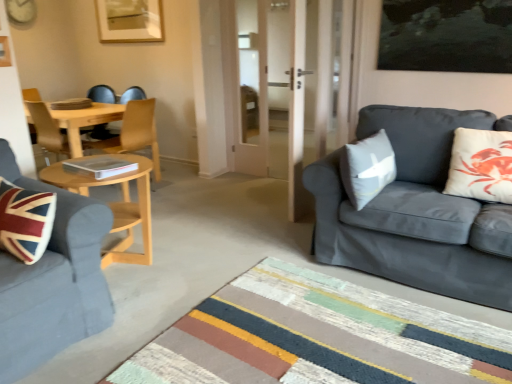
Question: Is velvet blue sofa at left, placed as the second studio couch when sorted from right to left, smaller than gray fabric pillow at right, which is counted as the first pillow, starting from the left?

Choices:
 (A) no
 (B) yes

Answer: (A)

Question: From a real-world perspective, is velvet blue sofa at left, the 1th studio couch from the left, physically above gray fabric pillow at right, the 2th pillow when ordered from right to left?

Choices:
 (A) yes
 (B) no

Answer: (B)

Question: From the image's perspective, is velvet blue sofa at left, the 1th studio couch from the left, over gray fabric pillow at right, which is counted as the first pillow, starting from the left?

Choices:
 (A) no
 (B) yes

Answer: (A)

Question: Does velvet blue sofa at left, the 1th studio couch from the left, have a greater width compared to gray fabric pillow at right, the 2th pillow when ordered from right to left?

Choices:
 (A) yes
 (B) no

Answer: (A)

Question: Considering the relative sizes of velvet blue sofa at left, placed as the second studio couch when sorted from right to left, and gray fabric pillow at right, which is counted as the first pillow, starting from the left, in the image provided, is velvet blue sofa at left, placed as the second studio couch when sorted from right to left, taller than gray fabric pillow at right, which is counted as the first pillow, starting from the left,?

Choices:
 (A) yes
 (B) no

Answer: (A)

Question: In the image, is velvet blue sofa at left, the 1th studio couch from the left, positioned in front of or behind light wood coffee table at center left?

Choices:
 (A) front
 (B) behind

Answer: (A)

Question: In terms of size, does velvet blue sofa at left, placed as the second studio couch when sorted from right to left, appear bigger or smaller than light wood coffee table at center left?

Choices:
 (A) big
 (B) small

Answer: (A)

Question: From a real-world perspective, relative to light wood coffee table at center left, is velvet blue sofa at left, placed as the second studio couch when sorted from right to left, vertically above or below?

Choices:
 (A) below
 (B) above

Answer: (B)

Question: From the image's perspective, is velvet blue sofa at left, the 1th studio couch from the left, above or below light wood coffee table at center left?

Choices:
 (A) above
 (B) below

Answer: (B)

Question: Looking at the image, does white matte cushion at right, acting as the second pillow starting from the left, seem bigger or smaller compared to wooden chair at center?

Choices:
 (A) big
 (B) small

Answer: (B)

Question: Is white matte cushion at right, acting as the second pillow starting from the left, taller or shorter than wooden chair at center?

Choices:
 (A) tall
 (B) short

Answer: (B)

Question: From a real-world perspective, is white matte cushion at right, acting as the second pillow starting from the left, above or below wooden chair at center?

Choices:
 (A) below
 (B) above

Answer: (B)

Question: Is white matte cushion at right, placed as the 1th pillow when sorted from right to left, in front of or behind wooden chair at center in the image?

Choices:
 (A) behind
 (B) front

Answer: (B)

Question: Is wooden chair at center in front of or behind light wood coffee table at center left in the image?

Choices:
 (A) behind
 (B) front

Answer: (A)

Question: From the image's perspective, relative to light wood coffee table at center left, is wooden chair at center above or below?

Choices:
 (A) below
 (B) above

Answer: (B)